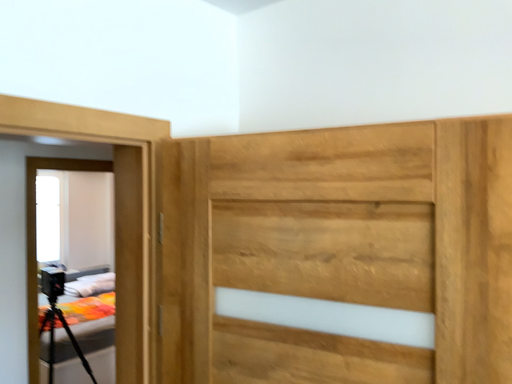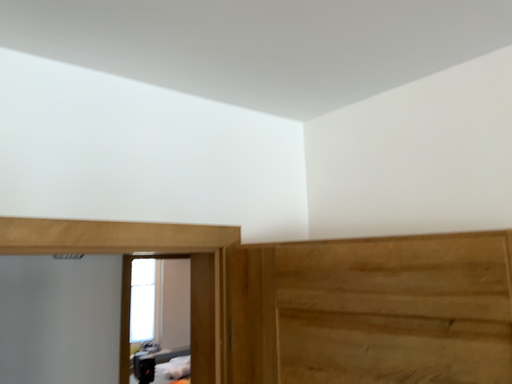
Question: Which way did the camera rotate in the video?

Choices:
 (A) rotated upward
 (B) rotated downward

Answer: (A)